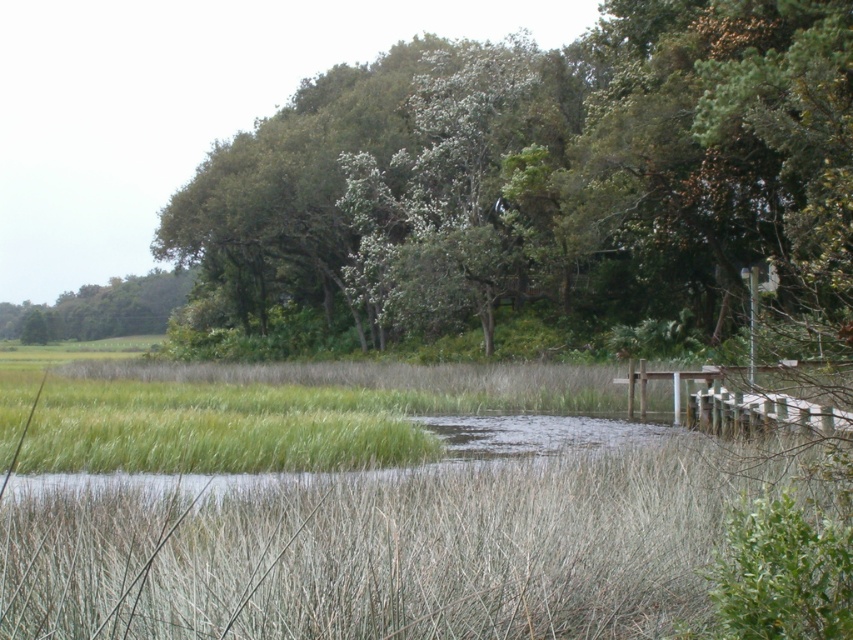
Question: Can you confirm if green leafy tree at upper center is positioned to the right of green leafy tree at upper left?

Choices:
 (A) yes
 (B) no

Answer: (A)

Question: Can you confirm if green leafy tree at upper center is wider than green leafy tree at upper left?

Choices:
 (A) yes
 (B) no

Answer: (B)

Question: Is green leafy tree at upper center further to camera compared to green leafy tree at upper left?

Choices:
 (A) no
 (B) yes

Answer: (A)

Question: Which object is closer to the camera taking this photo?

Choices:
 (A) green leafy tree at upper center
 (B) green leafy tree at upper left

Answer: (A)

Question: Which object appears farthest from the camera in this image?

Choices:
 (A) green leafy tree at upper left
 (B) green leafy tree at upper center

Answer: (A)